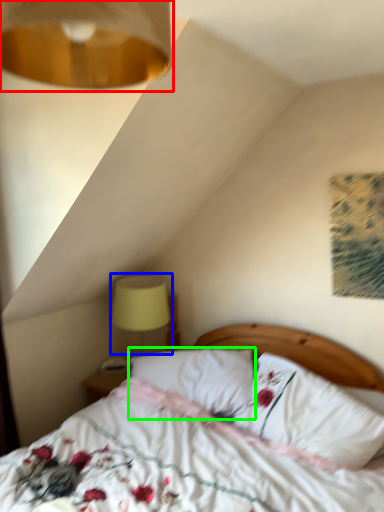
Question: Which object is the closest to the lamp (highlighted by a red box)? Choose among these: table lamp (highlighted by a blue box) or pillow (highlighted by a green box).

Choices:
 (A) table lamp
 (B) pillow

Answer: (B)